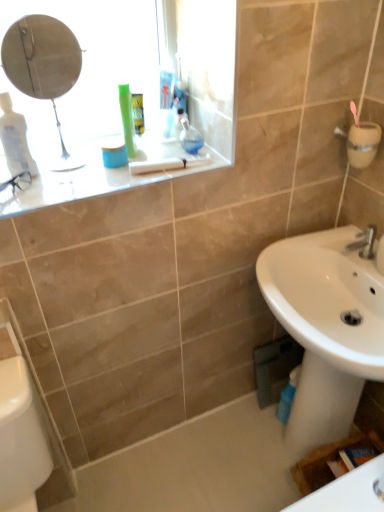
Question: Is white glossy porcelain at lower left smaller than white glossy counter top at upper left?

Choices:
 (A) no
 (B) yes

Answer: (A)

Question: Is white glossy porcelain at lower left at the left side of white glossy counter top at upper left?

Choices:
 (A) yes
 (B) no

Answer: (A)

Question: Does white glossy porcelain at lower left appear on the right side of white glossy counter top at upper left?

Choices:
 (A) no
 (B) yes

Answer: (A)

Question: Does white glossy porcelain at lower left lie in front of white glossy counter top at upper left?

Choices:
 (A) yes
 (B) no

Answer: (A)

Question: Is white glossy counter top at upper left located within white glossy porcelain at lower left?

Choices:
 (A) no
 (B) yes

Answer: (A)

Question: Is white glossy porcelain at lower left further to camera compared to white glossy counter top at upper left?

Choices:
 (A) yes
 (B) no

Answer: (B)

Question: From the image's perspective, is white glossy counter top at upper left above silver metallic faucet at lower right?

Choices:
 (A) yes
 (B) no

Answer: (A)

Question: Does white glossy counter top at upper left have a larger size compared to silver metallic faucet at lower right?

Choices:
 (A) no
 (B) yes

Answer: (B)

Question: Can you confirm if white glossy counter top at upper left is smaller than silver metallic faucet at lower right?

Choices:
 (A) no
 (B) yes

Answer: (A)

Question: Can you confirm if white glossy counter top at upper left is shorter than silver metallic faucet at lower right?

Choices:
 (A) yes
 (B) no

Answer: (A)

Question: Is white glossy counter top at upper left looking in the opposite direction of silver metallic faucet at lower right?

Choices:
 (A) no
 (B) yes

Answer: (A)

Question: Are white glossy counter top at upper left and silver metallic faucet at lower right far apart?

Choices:
 (A) no
 (B) yes

Answer: (A)

Question: Does white glossy bath at lower center appear on the left side of silver metallic faucet at lower right?

Choices:
 (A) no
 (B) yes

Answer: (B)